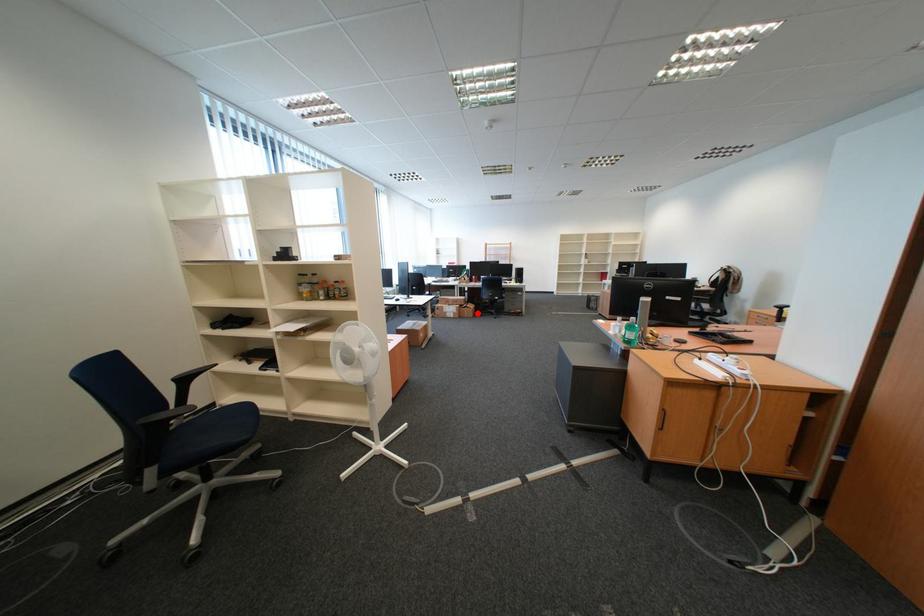
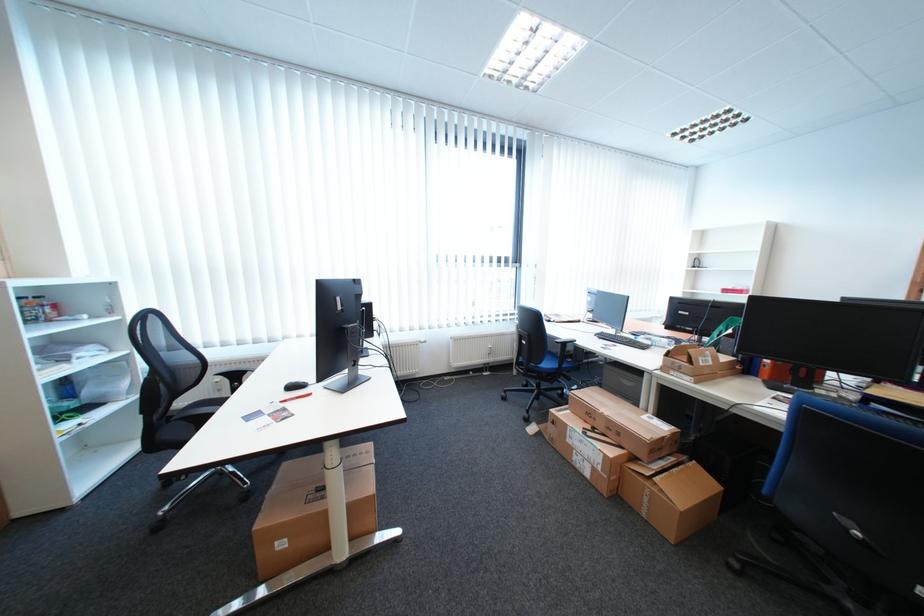
Locate, in the second image, the point that corresponds to the highlighted location in the first image.

(658, 499)